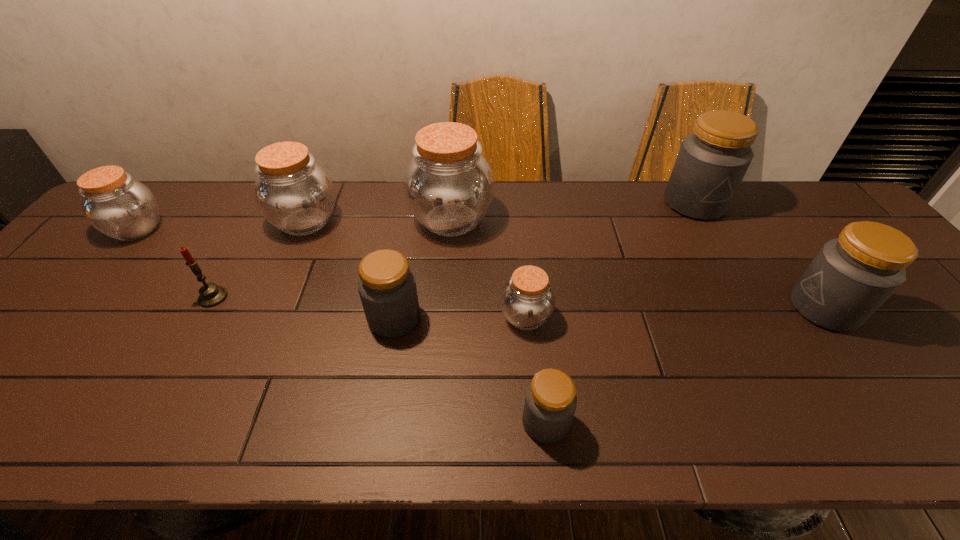
Locate an element on the screen. the closest brown jar to the second gray jar from left to right is located at coordinates (527, 300).

Find the location of a particular element. The height and width of the screenshot is (540, 960). the second closest brown jar to the second smallest gray jar is located at coordinates (527, 300).

Locate an element on the screen. The image size is (960, 540). vacant space that satisfies the following two spatial constraints: 1. on the back side of the red candle; 2. on the right side of the third brown jar from left to right is located at coordinates (257, 220).